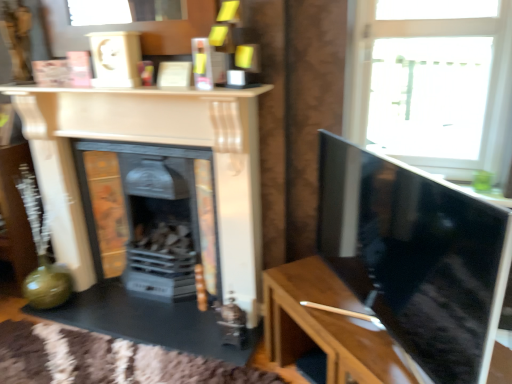
Question: Is matte black fireplace at center, marked as the 2th fireplace in a front-to-back arrangement, wider than wooden table at right?

Choices:
 (A) yes
 (B) no

Answer: (B)

Question: Is matte black fireplace at center, positioned as the 1th fireplace in back-to-front order, smaller than wooden table at right?

Choices:
 (A) no
 (B) yes

Answer: (A)

Question: Is matte black fireplace at center, positioned as the 1th fireplace in back-to-front order, far away from wooden table at right?

Choices:
 (A) no
 (B) yes

Answer: (A)

Question: Is matte black fireplace at center, positioned as the 1th fireplace in back-to-front order, bigger than wooden table at right?

Choices:
 (A) yes
 (B) no

Answer: (A)

Question: Is matte black fireplace at center, positioned as the 1th fireplace in back-to-front order, placed right next to wooden table at right?

Choices:
 (A) no
 (B) yes

Answer: (A)

Question: Considering their positions, is matte cream fireplace at center, which is the 2th fireplace in back-to-front order, located in front of or behind matte black fireplace at center, marked as the 2th fireplace in a front-to-back arrangement?

Choices:
 (A) behind
 (B) front

Answer: (B)

Question: Based on their positions, is matte cream fireplace at center, which is the 2th fireplace in back-to-front order, located to the left or right of matte black fireplace at center, marked as the 2th fireplace in a front-to-back arrangement?

Choices:
 (A) right
 (B) left

Answer: (B)

Question: Looking at the image, does matte cream fireplace at center, which ranks as the 1th fireplace in front-to-back order, seem bigger or smaller compared to matte black fireplace at center, positioned as the 1th fireplace in back-to-front order?

Choices:
 (A) big
 (B) small

Answer: (A)

Question: In terms of width, does matte cream fireplace at center, which ranks as the 1th fireplace in front-to-back order, look wider or thinner when compared to matte black fireplace at center, marked as the 2th fireplace in a front-to-back arrangement?

Choices:
 (A) thin
 (B) wide

Answer: (A)

Question: Considering their positions, is wooden table at right located in front of or behind transparent glass window at upper right?

Choices:
 (A) behind
 (B) front

Answer: (B)

Question: Is wooden table at right to the left or to the right of transparent glass window at upper right in the image?

Choices:
 (A) left
 (B) right

Answer: (A)

Question: From a real-world perspective, is wooden table at right positioned above or below transparent glass window at upper right?

Choices:
 (A) above
 (B) below

Answer: (B)

Question: Based on their sizes in the image, would you say wooden table at right is bigger or smaller than transparent glass window at upper right?

Choices:
 (A) big
 (B) small

Answer: (A)

Question: Considering the positions of point (382, 344) and point (143, 162), is point (382, 344) closer or farther from the camera than point (143, 162)?

Choices:
 (A) farther
 (B) closer

Answer: (B)

Question: In the image, is wooden table at right positioned in front of or behind matte black fireplace at center, positioned as the 1th fireplace in back-to-front order?

Choices:
 (A) behind
 (B) front

Answer: (B)